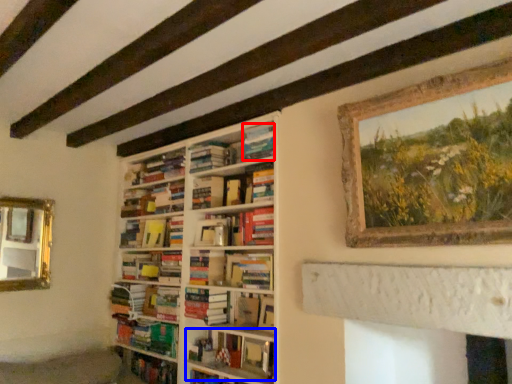
Question: Among these objects, which one is nearest to the camera, paperback book (highlighted by a red box) or book (highlighted by a blue box)?

Choices:
 (A) paperback book
 (B) book

Answer: (B)